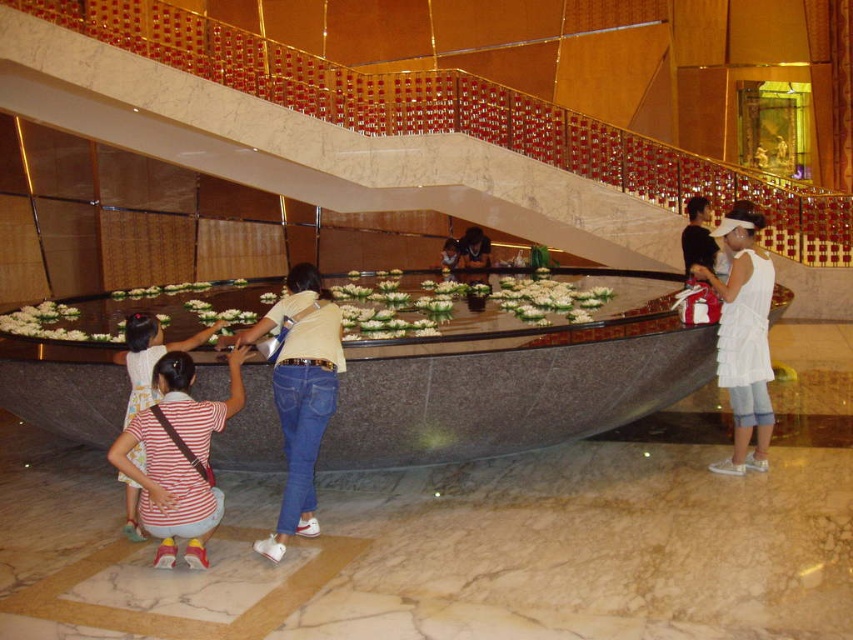
In the scene described, there are two people wearing the white cotton dress at right and the striped fabric shirt at lower left. Which one is positioned more to the east side of the scene?

The white cotton dress at right is positioned to the right of the striped fabric shirt at lower left, so it is more to the east side of the scene.

You are standing in the grand indoor space and see the jeans at center and the white cotton dress at right. Which clothing item is positioned closer to the left side of the scene?

The jeans at center is positioned to the left of the white cotton dress at right, so the jeans at center is closer to the left side of the scene.